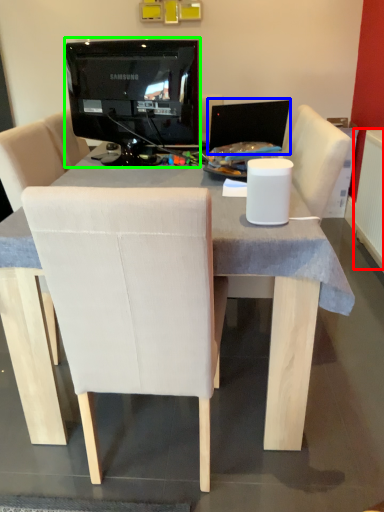
Question: Which is farther away from radiator (highlighted by a red box)? computer monitor (highlighted by a blue box) or television (highlighted by a green box)?

Choices:
 (A) computer monitor
 (B) television

Answer: (B)